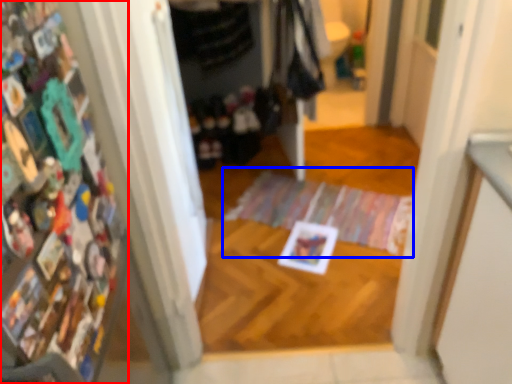
Question: Which object appears farthest to the camera in this image, book (highlighted by a red box) or doormat (highlighted by a blue box)?

Choices:
 (A) book
 (B) doormat

Answer: (B)